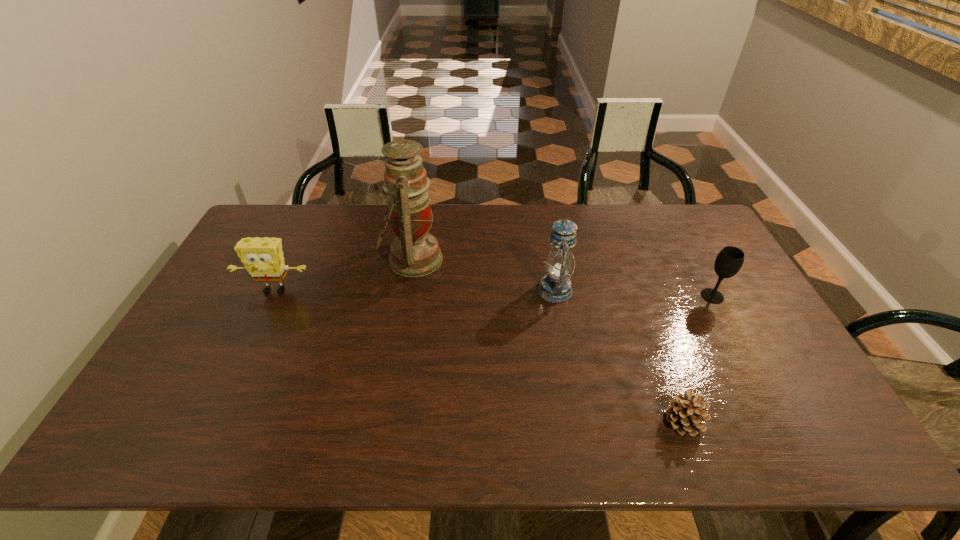
Where is `free spot between the pinecone and the oil lamp`? free spot between the pinecone and the oil lamp is located at coordinates (548, 341).

Locate an element on the screen. vacant area between the sponge and the lantern is located at coordinates (415, 290).

Locate which object ranks second in proximity to the tallest object. Please provide its 2D coordinates. Your answer should be formatted as a tuple, i.e. [(x, y)], where the tuple contains the x and y coordinates of a point satisfying the conditions above.

[(555, 286)]

You are a GUI agent. You are given a task and a screenshot of the screen. Output one action in this format:
    pyautogui.click(x=<x>, y=<y>)
    Task: Click on the object that ranks as the second closest to the rightmost object
    This screenshot has height=540, width=960.
    Given the screenshot: What is the action you would take?
    pyautogui.click(x=555, y=286)

Where is `vacant space that satisfies the following two spatial constraints: 1. on the front side of the oil lamp; 2. on the left side of the pinecone`? The image size is (960, 540). vacant space that satisfies the following two spatial constraints: 1. on the front side of the oil lamp; 2. on the left side of the pinecone is located at coordinates (385, 422).

This screenshot has width=960, height=540. I want to click on free space that satisfies the following two spatial constraints: 1. on the face of the shortest object; 2. on the right side of the sponge, so click(x=210, y=422).

The image size is (960, 540). Find the location of `free location that satisfies the following two spatial constraints: 1. on the face of the sponge; 2. on the left side of the rightmost object`. free location that satisfies the following two spatial constraints: 1. on the face of the sponge; 2. on the left side of the rightmost object is located at coordinates (272, 296).

This screenshot has width=960, height=540. Find the location of `free space that satisfies the following two spatial constraints: 1. on the front-facing side of the third object from right to left; 2. on the left side of the wineglass`. free space that satisfies the following two spatial constraints: 1. on the front-facing side of the third object from right to left; 2. on the left side of the wineglass is located at coordinates (556, 296).

The width and height of the screenshot is (960, 540). Identify the location of vacant area that satisfies the following two spatial constraints: 1. on the front side of the rightmost object; 2. on the right side of the oil lamp. (407, 296).